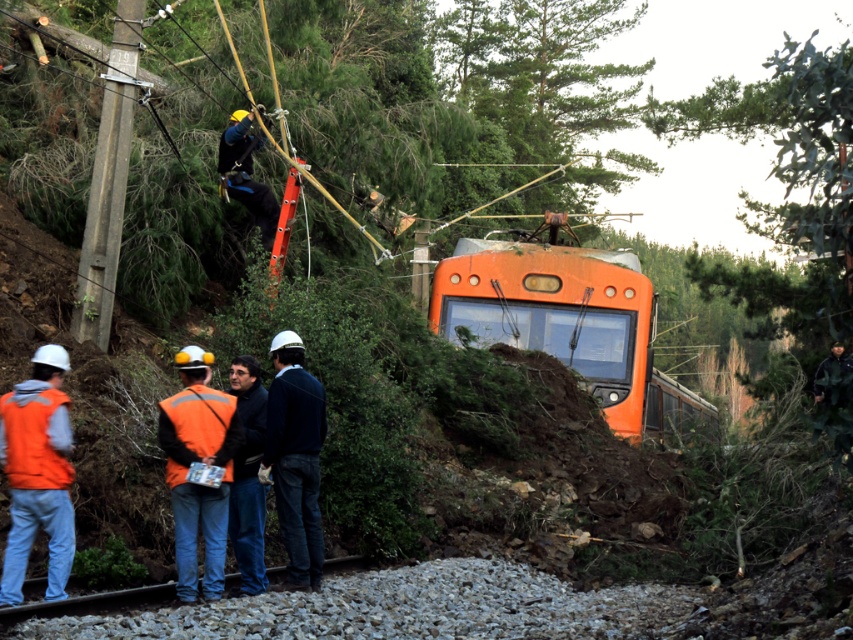
Question: Considering the real-world distances, which object is closest to the dark blue jeans at center?

Choices:
 (A) smooth gravel train track at lower center
 (B) orange fabric vest at lower center
 (C) green leafy tree at upper center

Answer: (B)

Question: In this image, where is orange matte train at center located relative to orange reflective vest at lower left?

Choices:
 (A) left
 (B) right

Answer: (B)

Question: Which point appears closest to the camera in this image?

Choices:
 (A) (260, 387)
 (B) (62, 422)

Answer: (B)

Question: Can you confirm if orange matte train at center is thinner than dark blue jeans at center?

Choices:
 (A) no
 (B) yes

Answer: (A)

Question: Which point appears farthest from the camera in this image?

Choices:
 (A) (x=103, y=602)
 (B) (x=238, y=515)

Answer: (B)

Question: Can you confirm if dark blue jeans at center is positioned to the left of smooth gravel train track at lower center?

Choices:
 (A) yes
 (B) no

Answer: (B)